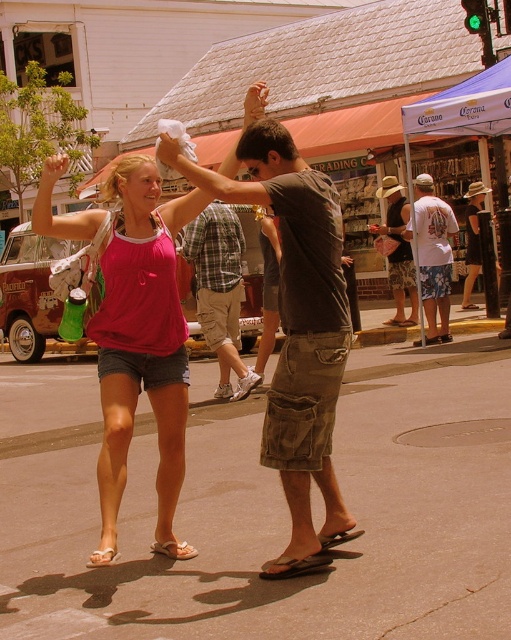
Question: Can you confirm if cotton plaid shirt at center is positioned below white cotton t-shirt at center?

Choices:
 (A) yes
 (B) no

Answer: (A)

Question: Is brown cotton shirt at center smaller than white rubber sandal at lower left?

Choices:
 (A) yes
 (B) no

Answer: (B)

Question: Is cotton plaid shirt at center closer to the viewer compared to white cotton t-shirt at center?

Choices:
 (A) no
 (B) yes

Answer: (B)

Question: Which object appears closest to the camera in this image?

Choices:
 (A) brown cargo shorts at center
 (B) brown cotton shirt at center
 (C) white rubber sandal at lower left

Answer: (B)

Question: Among these points, which one is farthest from the camera?

Choices:
 (A) (169, 545)
 (B) (375, 227)

Answer: (B)

Question: Which of the following is the farthest from the observer?

Choices:
 (A) (105, 563)
 (B) (435, 342)
 (C) (243, 241)
 (D) (158, 292)

Answer: (B)